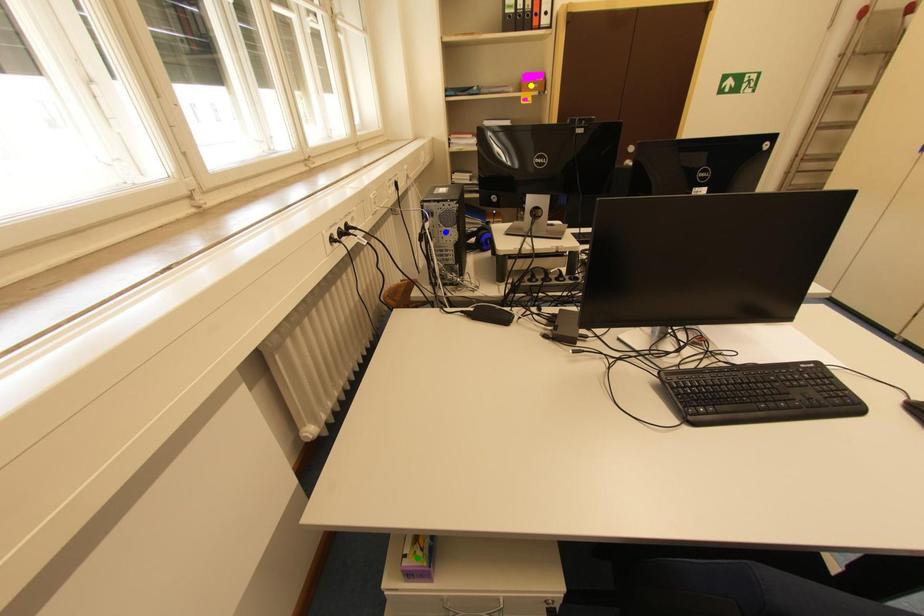
Order these from nearest to farthest:
blue point
green point
yellow point

1. green point
2. blue point
3. yellow point